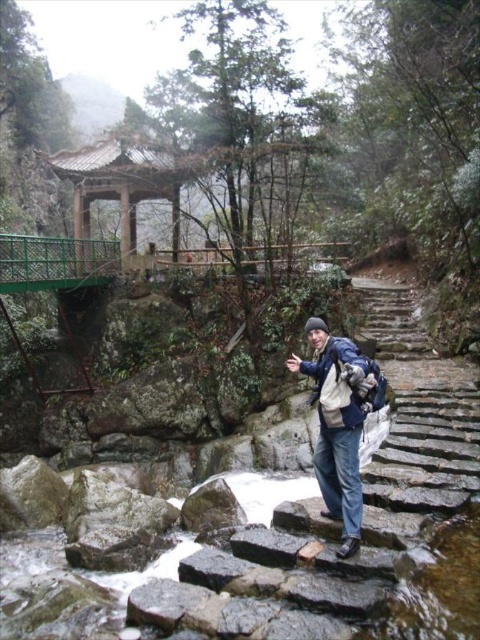
Question: Which object appears closest to the camera in this image?

Choices:
 (A) blue fabric backpack at center
 (B) wooden gazebo at upper center

Answer: (A)

Question: Among these objects, which one is farthest from the camera?

Choices:
 (A) blue fabric backpack at center
 (B) wooden gazebo at upper center

Answer: (B)

Question: Does blue fabric backpack at center appear under wooden gazebo at upper center?

Choices:
 (A) no
 (B) yes

Answer: (B)

Question: Which point is farther to the camera?

Choices:
 (A) blue fabric backpack at center
 (B) wooden gazebo at upper center

Answer: (B)

Question: Does blue fabric backpack at center appear under wooden gazebo at upper center?

Choices:
 (A) no
 (B) yes

Answer: (B)

Question: Does blue fabric backpack at center have a greater width compared to wooden gazebo at upper center?

Choices:
 (A) no
 (B) yes

Answer: (B)